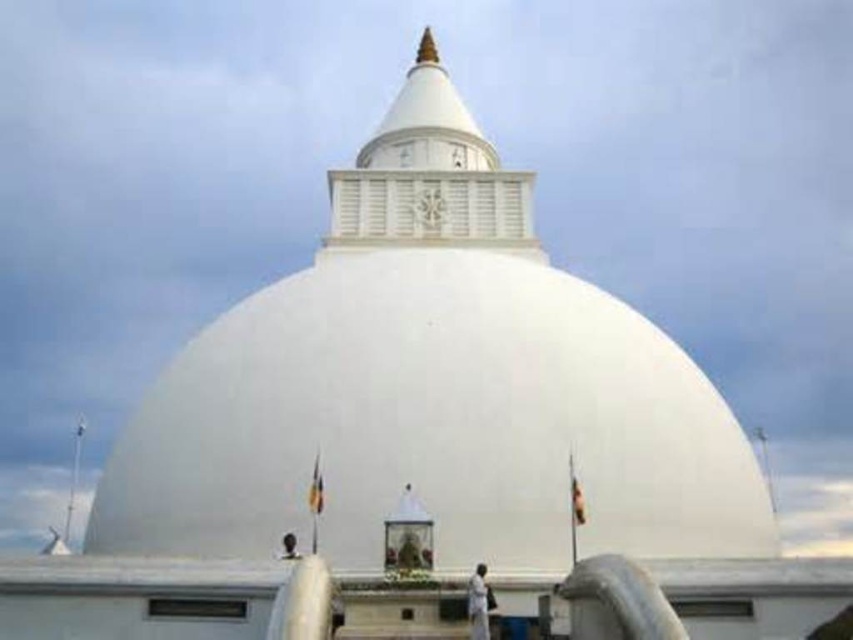
You are standing at the base of the white smooth dome at center and want to walk to the black matte person at center. How far will you have to walk?

The white smooth dome at center is 82.02 feet from the black matte person at center, so you will have to walk 82.02 feet to reach them.

You are standing in front of the white smooth dome at center. If you want to take a photo that includes the entire structure without any cropping, what is the minimum distance you should move back from your current position?

The minimum distance you should move back is 50.91 meters to ensure the entire white smooth dome at center fits in the photo without cropping.

You are standing at a certain point and want to visit the golden spire on top of the white dome. The point you are currently at is marked as point (573,304). Given that the distance between you and the golden spire is 63.22 meters, is this distance considered short enough for a comfortable walk without feeling exhausted?

The distance between point (573,304) and the golden spire is 63.22 meters. This distance is considered short enough for a comfortable walk without feeling exhausted.